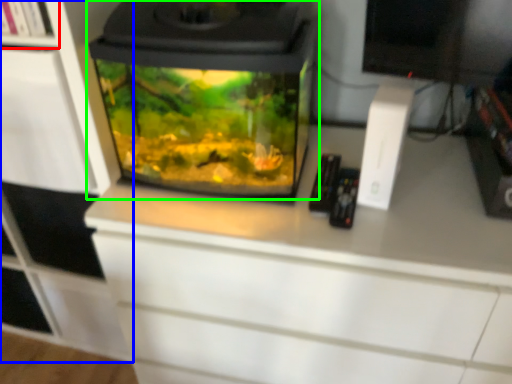
Question: Which object is positioned farthest from shelf (highlighted by a red box)? Select from cabinetry (highlighted by a blue box) and home appliance (highlighted by a green box).

Choices:
 (A) cabinetry
 (B) home appliance

Answer: (B)